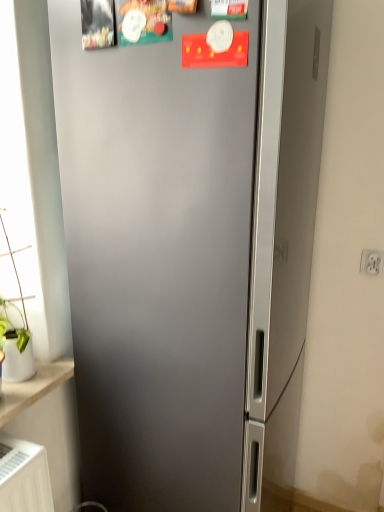
What do you see at coordinates (372, 262) in the screenshot? I see `white plastic electric outlet at right` at bounding box center [372, 262].

Where is `white plastic electric outlet at right`? white plastic electric outlet at right is located at coordinates (372, 262).

Identify the location of white plastic electric outlet at right. Image resolution: width=384 pixels, height=512 pixels. (372, 262).